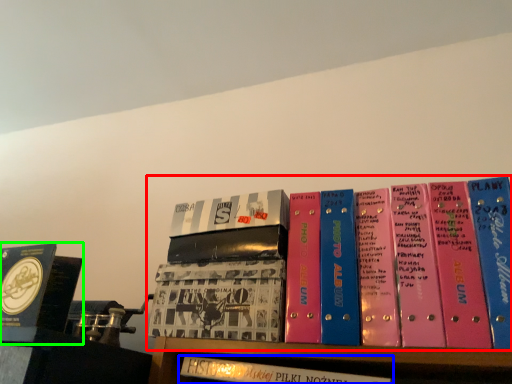
Question: Considering the real-world distances, which object is closest to book (highlighted by a red box)? book (highlighted by a blue box) or book (highlighted by a green box).

Choices:
 (A) book
 (B) book

Answer: (A)